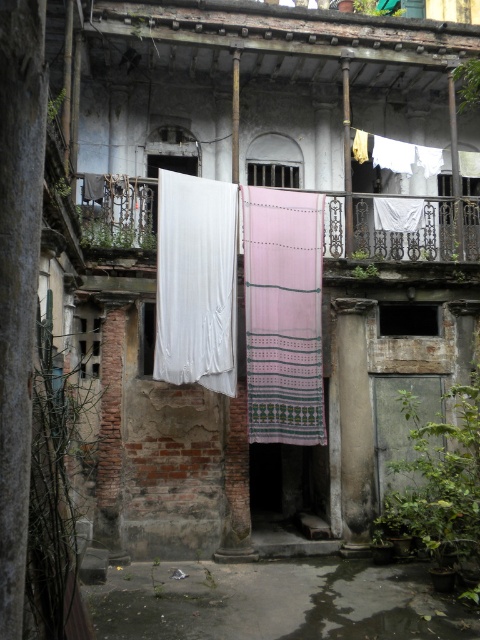
Who is higher up, concrete floor at lower center or white fabric curtain at left?

white fabric curtain at left is above.

Between concrete floor at lower center and white fabric curtain at left, which one has less height?

With less height is concrete floor at lower center.

What do you see at coordinates (276, 602) in the screenshot? I see `concrete floor at lower center` at bounding box center [276, 602].

The width and height of the screenshot is (480, 640). Identify the location of concrete floor at lower center. (276, 602).

Which is below, pink woven cloth at center or white fabric curtain at left?

pink woven cloth at center is lower down.

Who is more forward, (312, 403) or (173, 288)?

Point (173, 288) is more forward.

Between point (288, 352) and point (230, 208), which one is positioned in front?

Positioned in front is point (288, 352).

The height and width of the screenshot is (640, 480). In order to click on pink woven cloth at center in this screenshot , I will do click(284, 316).

Is point (144, 564) closer to camera compared to point (264, 376)?

Yes, it is.

The width and height of the screenshot is (480, 640). What do you see at coordinates (276, 602) in the screenshot?
I see `concrete floor at lower center` at bounding box center [276, 602].

Describe the element at coordinates (276, 602) in the screenshot. Image resolution: width=480 pixels, height=640 pixels. I see `concrete floor at lower center` at that location.

Locate an element on the screen. concrete floor at lower center is located at coordinates (276, 602).